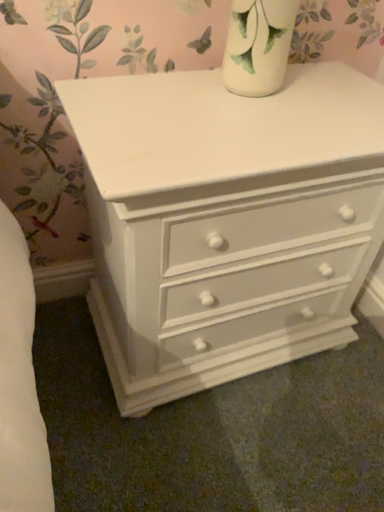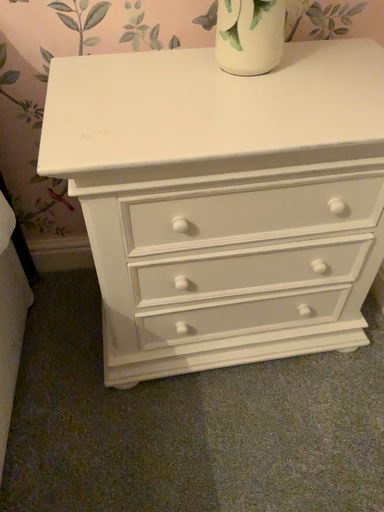
Question: How did the camera likely rotate when shooting the video?

Choices:
 (A) rotated left
 (B) rotated right

Answer: (A)